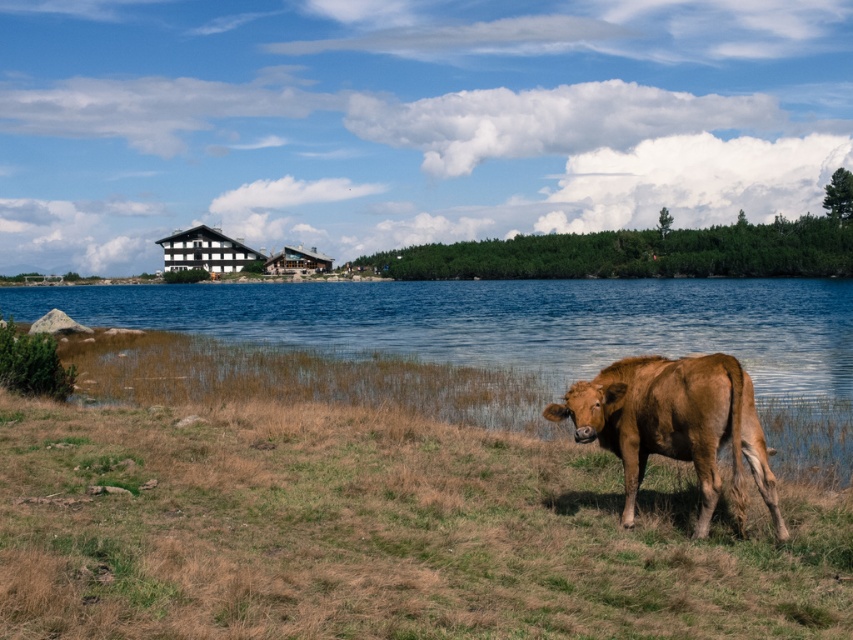
Between brown grassy at lower right and brown glossy bull at lower right, which one is positioned higher?

Positioned higher is brown glossy bull at lower right.

Does brown grassy at lower right appear on the left side of brown glossy bull at lower right?

Yes, brown grassy at lower right is to the left of brown glossy bull at lower right.

Is point (590, 547) positioned behind point (749, 456)?

Yes, it is behind point (749, 456).

The width and height of the screenshot is (853, 640). I want to click on brown grassy at lower right, so click(x=379, y=531).